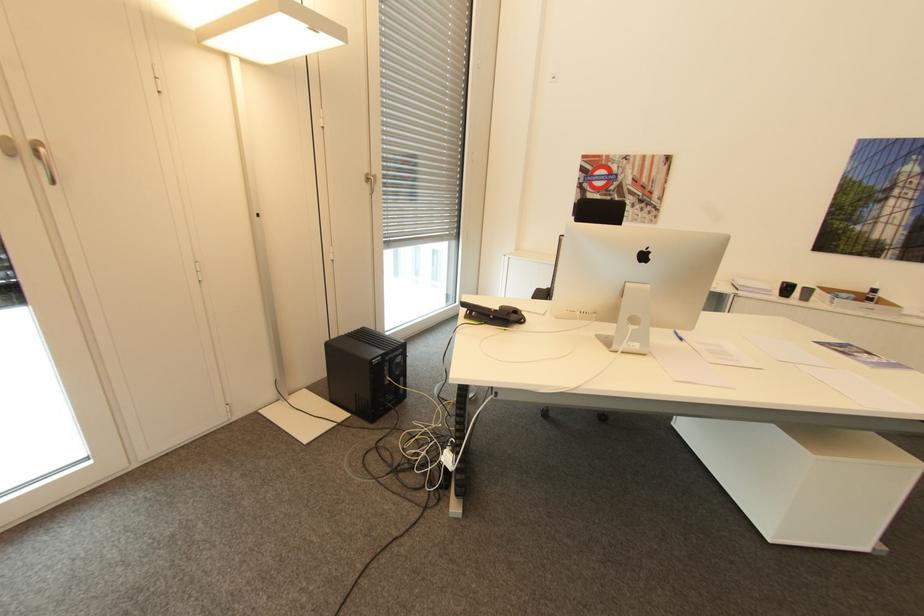
Find where to turn the silver door handle. Please return your answer as a coordinate pair (x, y).

(43, 159)